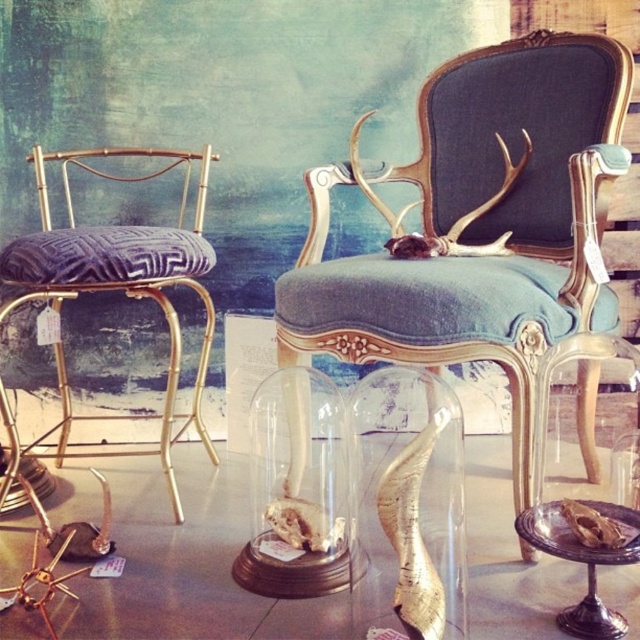
You are an interior designer planning to place a new rectangular table between the gold metallic stool at left and the transparent glass skull at lower right. The table must be exactly 1.2 meters wide. Based on the scene, will the space between them accommodate this table?

The gold metallic stool at left is wider than the transparent glass skull at lower right. However, the description only provides information about their widths, not the distance between them. Without knowing the actual space between the two objects, it is impossible to determine if the 1.2 meter table will fit.

From the picture: You are standing in front of the vintage interior scene. There are two points marked in the image. The first point is at coordinate point (490, 620) and the second point is at coordinate point (588, 580). Which point is closer to you?

Point (490, 620) is closer to you than point (588, 580) because the description states that point (490, 620) is closer to the camera than point (588, 580).

You are arranging a display and need to place the gold metallic stool at left and the transparent glass skull at lower right. Based on their positions, which object is closer to the entrance of the room?

The gold metallic stool at left is closer to the entrance because it is positioned on the left side of the transparent glass skull at lower right, implying it is nearer to the entrance if the entrance is on the left side of the room.